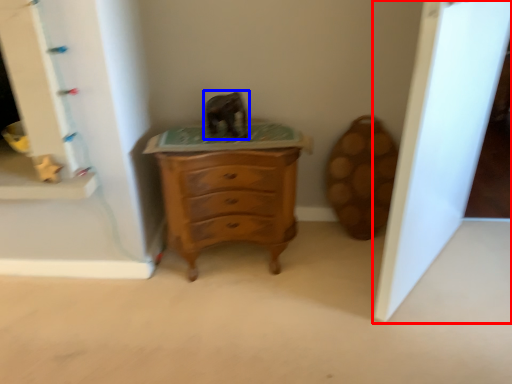
Question: Which point is closer to the camera, glass door (highlighted by a red box) or animal (highlighted by a blue box)?

Choices:
 (A) glass door
 (B) animal

Answer: (A)